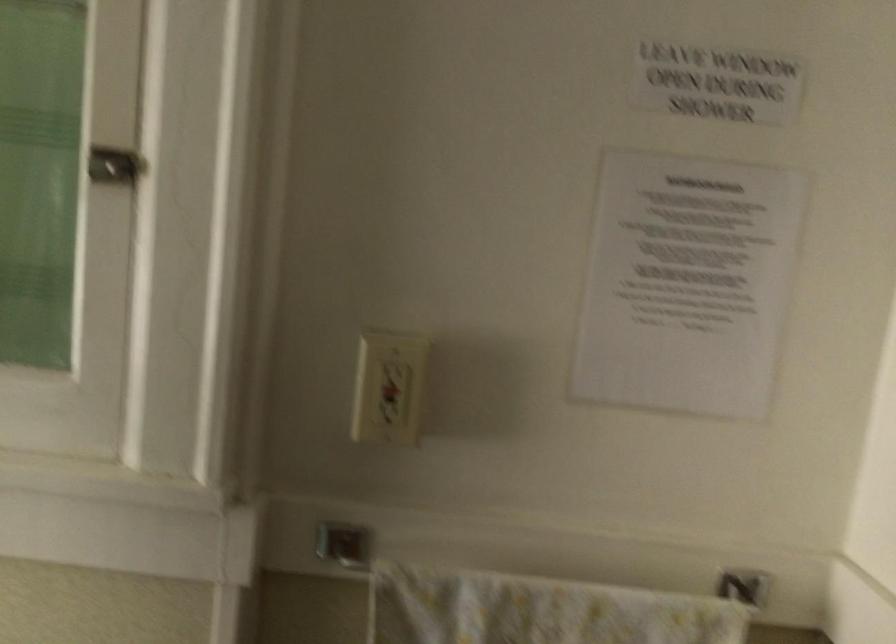
What are the coordinates of `cabinet door latch` in the screenshot? It's located at (115, 165).